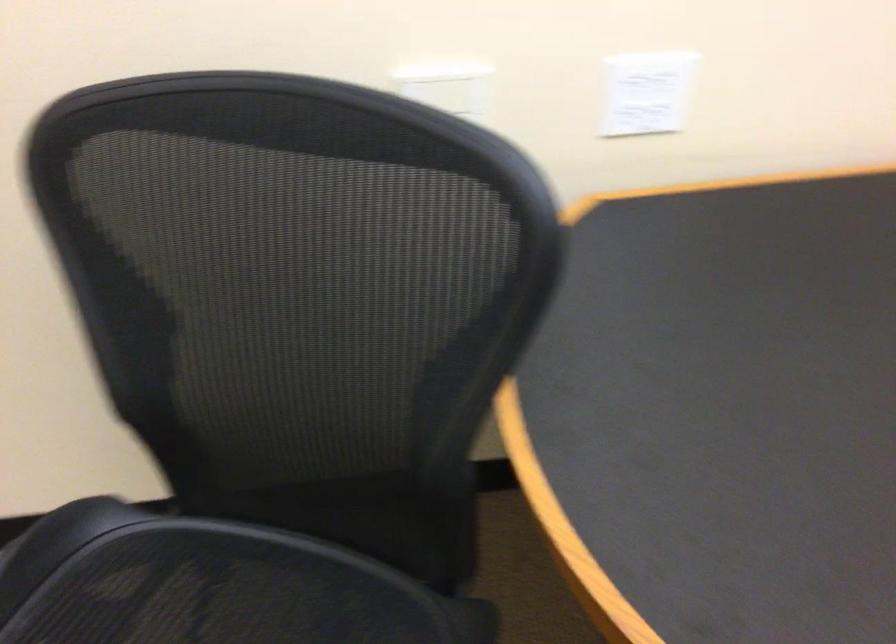
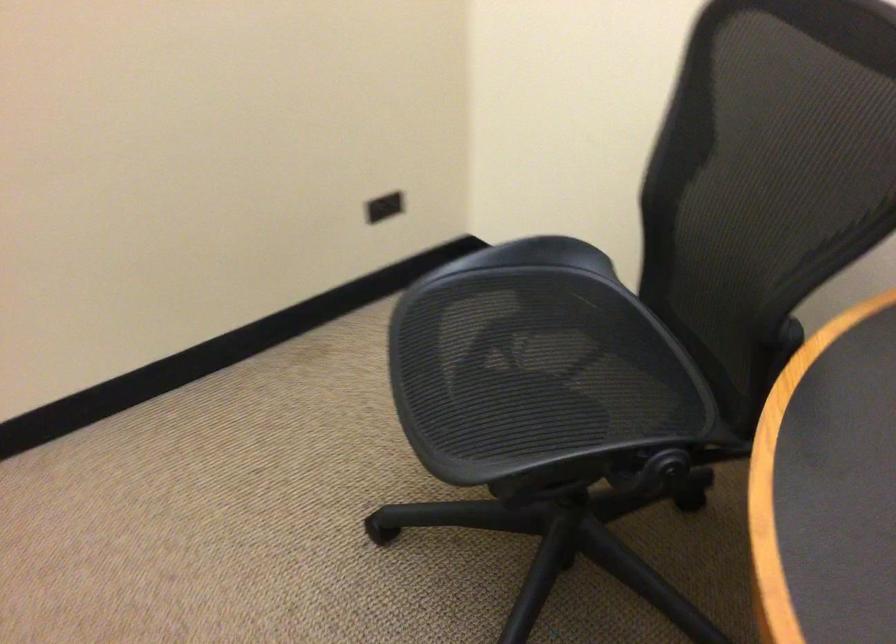
Question: The camera is either moving clockwise (left) or counter-clockwise (right) around the object. The first image is from the beginning of the video and the second image is from the end. Is the camera moving left or right when shooting the video?

Choices:
 (A) Left
 (B) Right

Answer: (B)